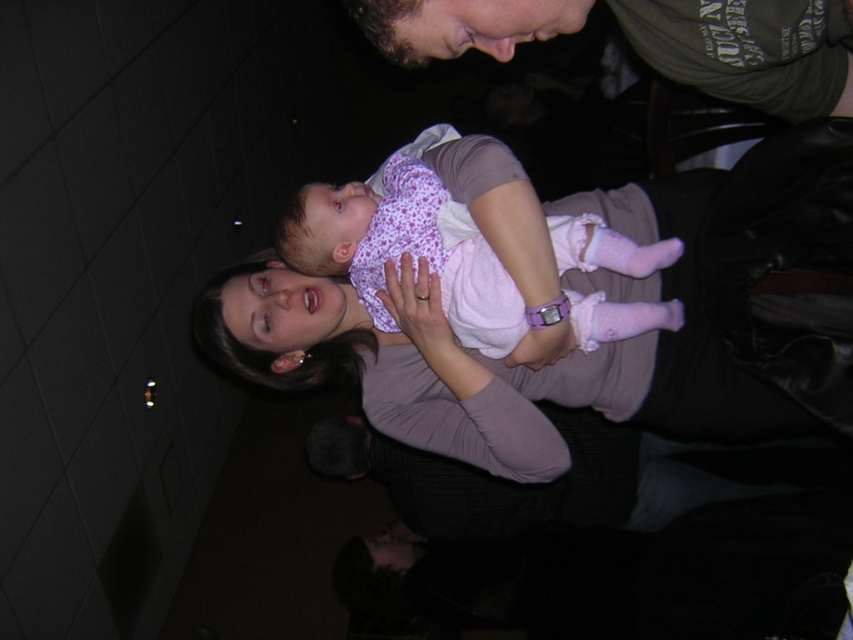
Question: Does dark gray sweater at center have a smaller size compared to dark green t-shirt at upper right?

Choices:
 (A) no
 (B) yes

Answer: (A)

Question: Which point is closer to the camera?

Choices:
 (A) purple dotted fabric at center
 (B) pink fabric baby at center

Answer: (B)

Question: Can you confirm if pink fabric baby at center is bigger than dark green t-shirt at upper right?

Choices:
 (A) yes
 (B) no

Answer: (A)

Question: Estimate the real-world distances between objects in this image. Which object is closer to the pink fabric baby at center?

Choices:
 (A) dark green t-shirt at upper right
 (B) purple dotted fabric at center
 (C) dark gray sweater at center
 (D) purple matte arm at center

Answer: (D)

Question: Which point is closer to the camera taking this photo?

Choices:
 (A) (426, 305)
 (B) (653, 577)

Answer: (A)

Question: Is purple dotted fabric at center further to the viewer compared to dark gray sweater at center?

Choices:
 (A) yes
 (B) no

Answer: (B)